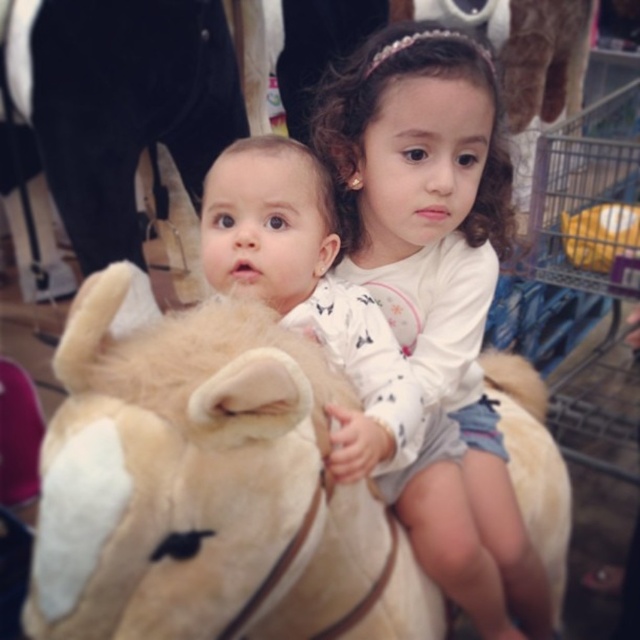
You are a parent at the carnival and want to ensure your child can comfortably sit on the fluffy beige horse at center without touching the white soft plush at center. Given that the child is 40 cm wide, can they fit between them?

The fluffy beige horse at center is wider than the white soft plush at center. Since the child is 40 cm wide, they can comfortably fit between them without touching either side.

From the picture: You are at a carnival and see the fluffy beige horse at center and the white soft plush at center. Which one is positioned to the left?

The fluffy beige horse at center is positioned to the left of the white soft plush at center.

You are standing in front of the fluffy beige horse at center at a fair. There is a point marked at coordinates (172, 465). Can you tell me what object this point is located on?

The point at coordinates (172, 465) is located on the fluffy beige horse at center.